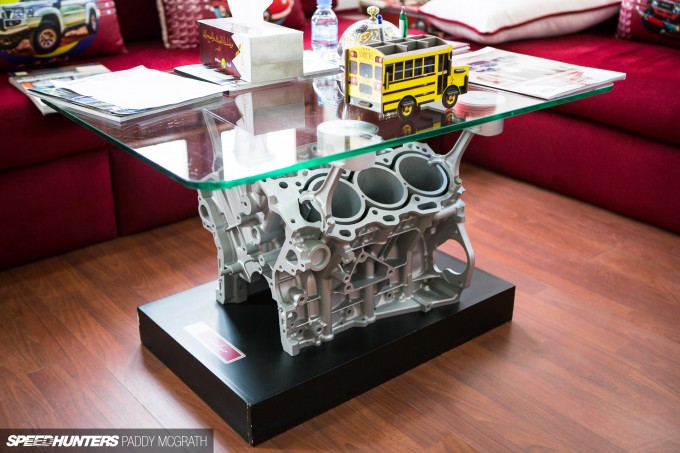
Find the location of a particular element. The height and width of the screenshot is (453, 680). box is located at coordinates (272, 39).